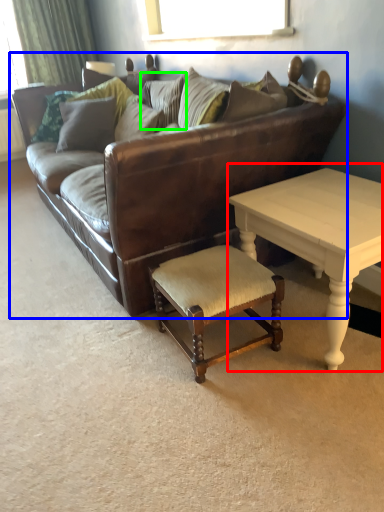
Question: Considering the real-world distances, which object is closest to coffee table (highlighted by a red box)? studio couch (highlighted by a blue box) or pillow (highlighted by a green box).

Choices:
 (A) studio couch
 (B) pillow

Answer: (A)